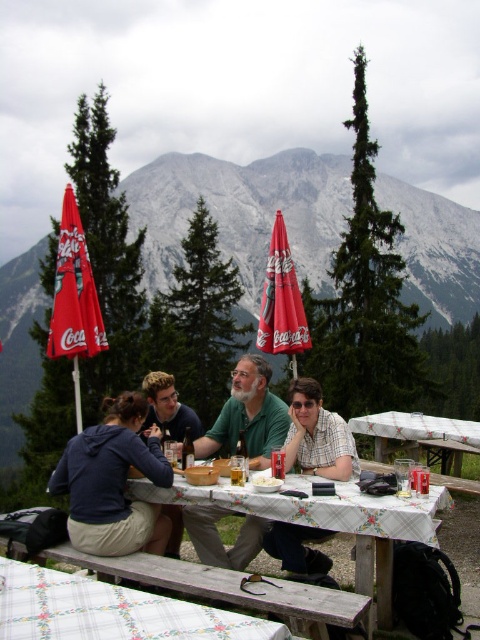
You are standing at the picnic table and want to reach both the point at (x=80, y=515) and the point at (x=259, y=544). Which point is closer to you?

Point at (x=80, y=515) is closer to you because it is in front of point at (x=259, y=544).

You are standing at a distance of 100 feet from a picnic table where four people are sitting. You want to throw a frisbee to the picnic table but need to know if you can reach it. The point you need to hit is at coordinates point (216, 518). Can you reach it?

The distance of point (216, 518) from viewer is 94.09 feet, so yes, you can reach it because it is within the 100 feet distance.

You are a photographer standing at the picnic table. You want to take a photo that includes both the green matte shirt at center and the white matte bowl at center. What is the minimum distance you need to move backward from the table to ensure both objects are in frame?

To include both the green matte shirt at center and the white matte bowl at center in the photo, you need to move at least 4.31 meters backward from the table since they are 4.31 meters apart from each other.